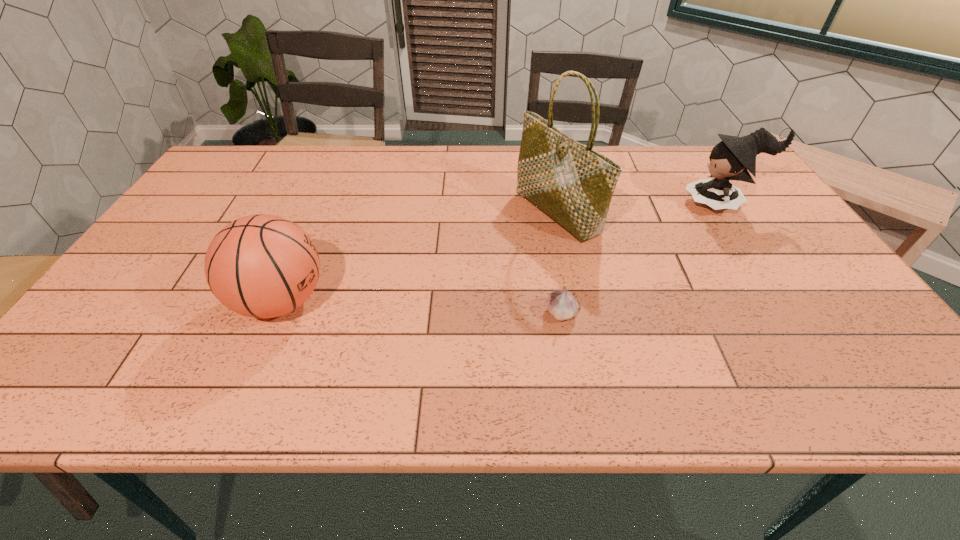
This screenshot has width=960, height=540. Identify the location of object that is at the right edge. (731, 159).

Locate an element on the screen. vacant space at the far edge of the desktop is located at coordinates (377, 153).

Identify the location of vacant region at the near edge. The width and height of the screenshot is (960, 540). (735, 402).

In the image, there is a desktop. Where is `vacant space at the left edge`? vacant space at the left edge is located at coordinates (157, 291).

I want to click on free spot at the right edge of the desktop, so click(x=811, y=308).

This screenshot has height=540, width=960. What are the coordinates of `vacant area between the tallest object and the garlic` in the screenshot? It's located at (559, 262).

The image size is (960, 540). Identify the location of free space between the shopping bag and the rightmost object. (639, 208).

I want to click on free space between the tallest object and the basketball, so pos(419,257).

Locate an element on the screen. This screenshot has height=540, width=960. unoccupied area between the garlic and the rightmost object is located at coordinates (641, 258).

Find the location of a particular element. free space between the shopping bag and the basketball is located at coordinates (419, 257).